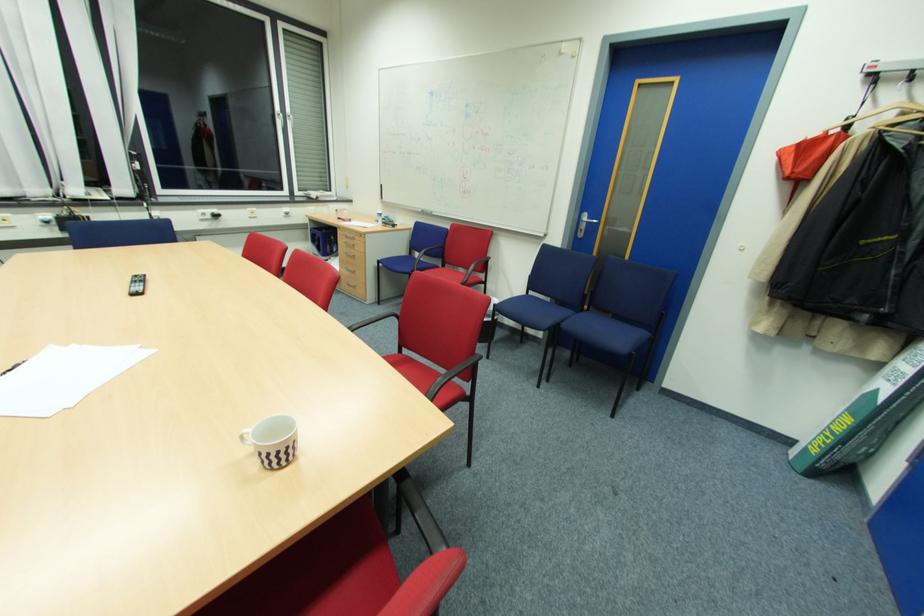
Where is `black remote control`? This screenshot has height=616, width=924. black remote control is located at coordinates (137, 285).